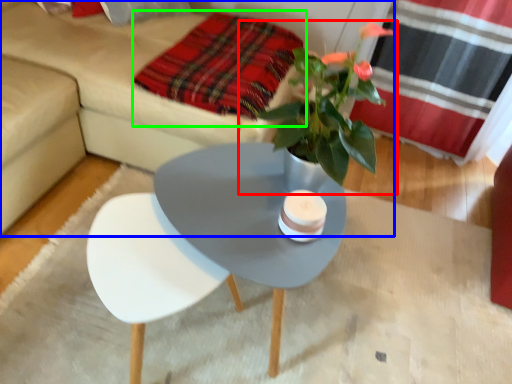
Question: Considering the real-world distances, which object is closest to houseplant (highlighted by a red box)? studio couch (highlighted by a blue box) or blanket (highlighted by a green box).

Choices:
 (A) studio couch
 (B) blanket

Answer: (B)